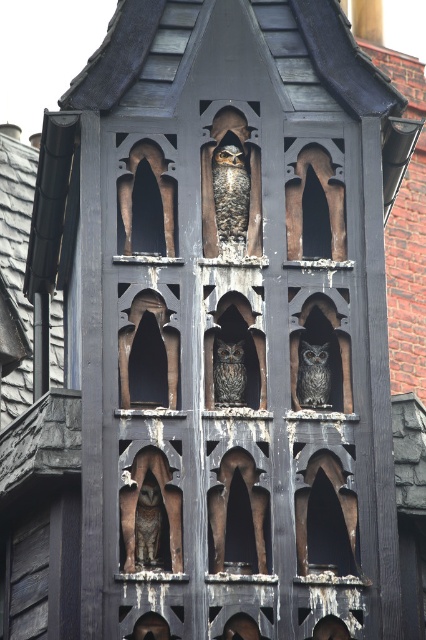
Question: Is transparent glass window at upper left below brown textured owl at lower left?

Choices:
 (A) no
 (B) yes

Answer: (A)

Question: Is speckled brown owl at center above transparent glass window at upper left?

Choices:
 (A) yes
 (B) no

Answer: (B)

Question: Is brown textured owl at lower left to the right of gray textured owl at center from the viewer's perspective?

Choices:
 (A) yes
 (B) no

Answer: (B)

Question: Based on their relative distances, which object is farther from the gray textured owl at center?

Choices:
 (A) transparent glass window at upper left
 (B) speckled brown owl at center
 (C) brown textured owl at lower left

Answer: (A)

Question: Based on their relative distances, which object is nearer to the dark gray textured owl at center?

Choices:
 (A) brown textured owl at lower left
 (B) speckled brown owl at center
 (C) transparent glass window at upper left
 (D) gray textured owl at center

Answer: (D)

Question: Which object is farther from the camera taking this photo?

Choices:
 (A) dark gray textured owl at center
 (B) transparent glass window at upper left
 (C) gray textured owl at center

Answer: (B)